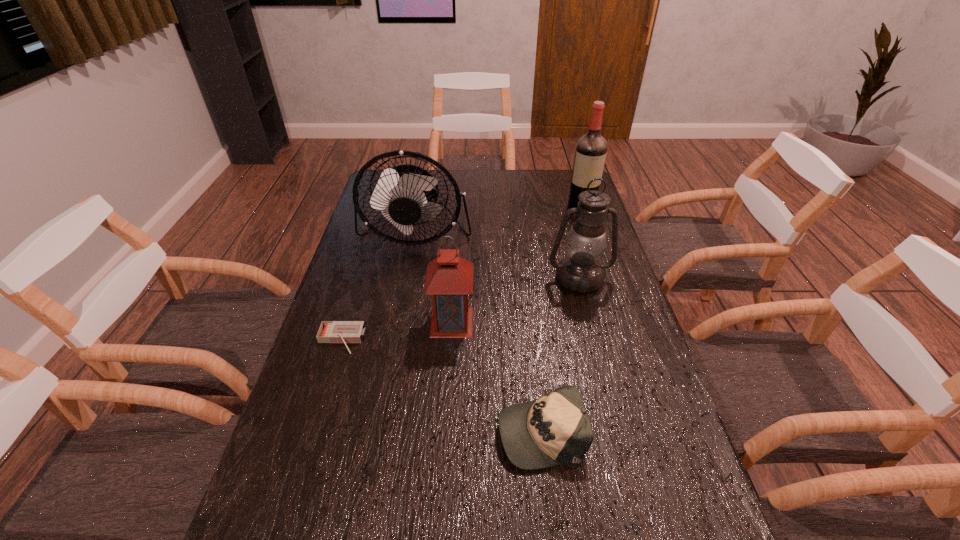
Identify the location of blank region between the shortest object and the lantern. This screenshot has width=960, height=540. (396, 331).

At what (x,y) coordinates should I click in order to perform the action: click on free space between the shortest object and the fifth tallest object. Please return your answer as a coordinate pair (x, y). Looking at the image, I should click on (441, 386).

Where is `the third closest object to the fan`? The image size is (960, 540). the third closest object to the fan is located at coordinates (345, 332).

The height and width of the screenshot is (540, 960). What are the coordinates of `object identified as the fifth closest to the third farthest object` in the screenshot? It's located at (345, 332).

You are a GUI agent. You are given a task and a screenshot of the screen. Output one action in this format:
    pyautogui.click(x=<x>, y=<y>)
    Task: Click on the vacant space that satisfies the following two spatial constraints: 1. in front of the fan, directing airflow; 2. on the left side of the fourth nearest object
    
    Given the screenshot: What is the action you would take?
    pyautogui.click(x=407, y=278)

I want to click on vacant point that satisfies the following two spatial constraints: 1. on the back side of the oil lamp; 2. on the right side of the lantern, so click(x=455, y=278).

Locate an element on the screen. Image resolution: width=960 pixels, height=540 pixels. vacant position in the image that satisfies the following two spatial constraints: 1. in front of the fourth tallest object, directing airflow; 2. on the right side of the fan is located at coordinates (398, 322).